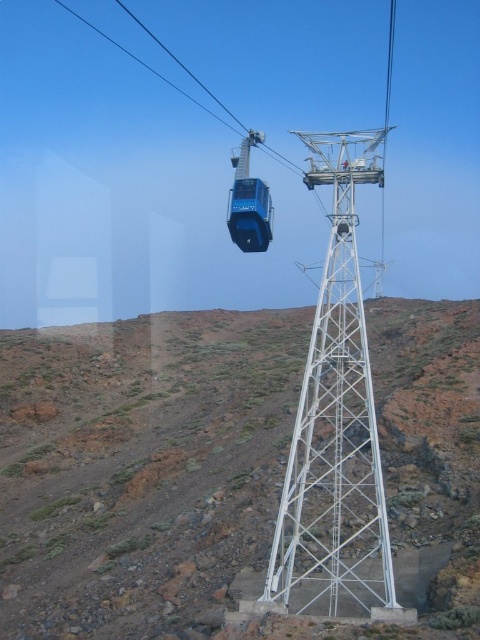
Question: Is brown rocky terrain at center to the left of blue glossy cable car at center from the viewer's perspective?

Choices:
 (A) no
 (B) yes

Answer: (A)

Question: Among these points, which one is farthest from the camera?

Choices:
 (A) (389, 106)
 (B) (290, 163)
 (C) (192, 336)

Answer: (A)

Question: Which of the following is the closest to the observer?

Choices:
 (A) blue glossy cable car at center
 (B) metallic cable car at upper center
 (C) brown rocky terrain at center

Answer: (C)

Question: Estimate the real-world distances between objects in this image. Which object is closer to the blue metallic cable car at upper center?

Choices:
 (A) metallic cable car at upper center
 (B) blue glossy cable car at center
 (C) brown rocky terrain at center
 (D) white metallic tower at center

Answer: (A)

Question: Does brown rocky terrain at center appear under blue metallic cable car at upper center?

Choices:
 (A) no
 (B) yes

Answer: (B)

Question: Does white metallic tower at center appear under metallic cable car at upper center?

Choices:
 (A) yes
 (B) no

Answer: (A)